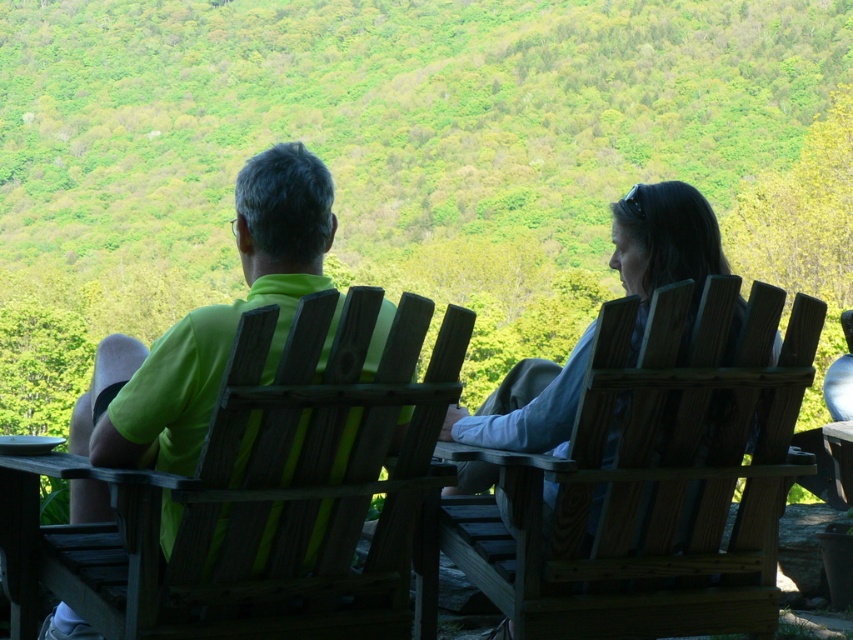
Question: Among these points, which one is farthest from the camera?

Choices:
 (A) (210, 392)
 (B) (492, 452)

Answer: (B)

Question: Does wooden chair at left have a smaller size compared to matte green shirt at center?

Choices:
 (A) yes
 (B) no

Answer: (A)

Question: Which point appears farthest from the camera in this image?

Choices:
 (A) (558, 582)
 (B) (381, 406)

Answer: (A)

Question: Can you confirm if wooden chair at right is positioned to the left of matte green shirt at center?

Choices:
 (A) yes
 (B) no

Answer: (B)

Question: Where is wooden chair at left located in relation to matte green shirt at center in the image?

Choices:
 (A) below
 (B) above

Answer: (A)

Question: Which object appears farthest from the camera in this image?

Choices:
 (A) matte green shirt at center
 (B) wooden chair at left
 (C) wooden chair at right

Answer: (C)